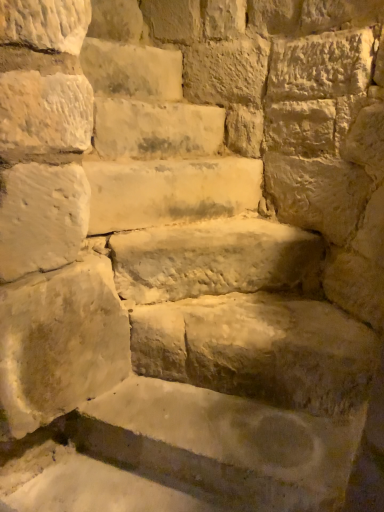
Question: From a real-world perspective, is smooth stone bench at center, the first brick positioned from the bottom, physically located above or below white stone at center, acting as the third brick starting from the top?

Choices:
 (A) above
 (B) below

Answer: (B)

Question: From the image's perspective, is smooth stone bench at center, the first brick positioned from the bottom, above or below white stone at center, acting as the third brick starting from the top?

Choices:
 (A) below
 (B) above

Answer: (A)

Question: Which object is positioned farthest from the smooth stone step at center?

Choices:
 (A) white stone at center, which is the second brick from bottom to top
 (B) smooth stone brick at upper left, acting as the 3th brick starting from the bottom
 (C) smooth stone bench at center, the first brick positioned from the bottom
 (D) smooth stone brick at upper left, arranged as the first brick when viewed from the top

Answer: (D)

Question: Considering the real-world distances, which object is farthest from the smooth stone brick at upper left, which ranks as the 2th brick in top-to-bottom order?

Choices:
 (A) smooth stone bench at center, the first brick positioned from the bottom
 (B) smooth stone brick at upper left, which ranks as the fourth brick in bottom-to-top order
 (C) white stone at center, acting as the third brick starting from the top
 (D) smooth stone step at center

Answer: (A)